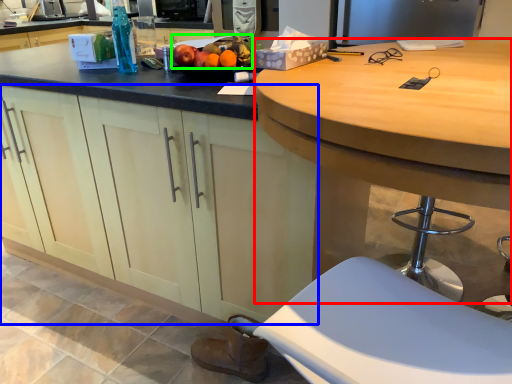
Question: Which object is positioned closest to desk (highlighted by a red box)? Select from cabinetry (highlighted by a blue box) and fruit (highlighted by a green box).

Choices:
 (A) cabinetry
 (B) fruit

Answer: (A)